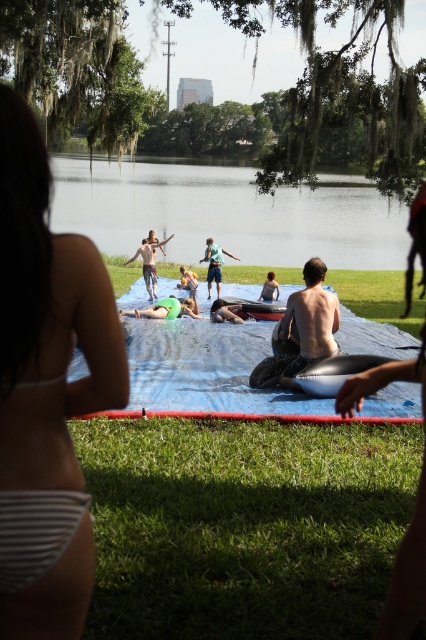
Question: Is white striped bikini at left to the right of light blue fabric at center from the viewer's perspective?

Choices:
 (A) no
 (B) yes

Answer: (A)

Question: Is blue tarp at center to the left of light blue fabric at center from the viewer's perspective?

Choices:
 (A) yes
 (B) no

Answer: (B)

Question: Among these objects, which one is farthest from the camera?

Choices:
 (A) tan skin human at center
 (B) blue tarp at center
 (C) green grass at lower center
 (D) clear blue water at center

Answer: (A)

Question: Observing the image, what is the correct spatial positioning of white striped bikini at left in reference to shiny black surfboard at center?

Choices:
 (A) below
 (B) above

Answer: (B)

Question: Which point is closer to the camera?

Choices:
 (A) blue tarp at center
 (B) tan skin human at center
 (C) matte gray shirt at center

Answer: (A)

Question: Which of the following is the closest to the observer?

Choices:
 (A) shiny black surfboard at center
 (B) green grass at lower center
 (C) blue tarp at center
 (D) white striped bikini at left

Answer: (D)